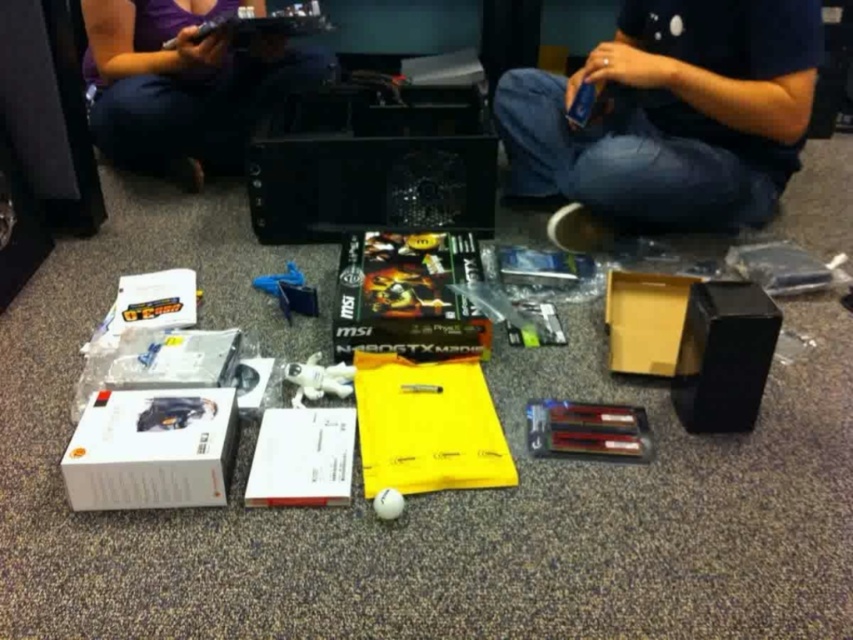
Is matte purple shirt at upper left shorter than white rubber ball at center?

A: No.

Does matte purple shirt at upper left have a greater width compared to white rubber ball at center?

Yes, matte purple shirt at upper left is wider than white rubber ball at center.

From the picture: Measure the distance between matte purple shirt at upper left and camera.

matte purple shirt at upper left and camera are 6.06 feet apart from each other.

Where is `matte purple shirt at upper left`? matte purple shirt at upper left is located at coordinates (x=183, y=83).

Can you confirm if white plastic astronaut at center is shorter than white rubber ball at center?

Incorrect, white plastic astronaut at center's height does not fall short of white rubber ball at center's.

Can you confirm if white plastic astronaut at center is positioned above white rubber ball at center?

Indeed, white plastic astronaut at center is positioned over white rubber ball at center.

Which is behind, point (337, 372) or point (396, 500)?

Positioned behind is point (337, 372).

Identify the location of white plastic astronaut at center. Image resolution: width=853 pixels, height=640 pixels. (318, 380).

Which is more to the right, blue denim jeans at lower right or blue plastic toy at center?

blue denim jeans at lower right

Can you confirm if blue denim jeans at lower right is positioned to the left of blue plastic toy at center?

Incorrect, blue denim jeans at lower right is not on the left side of blue plastic toy at center.

Is point (612, 147) positioned before point (289, 275)?

That is True.

I want to click on blue denim jeans at lower right, so click(672, 115).